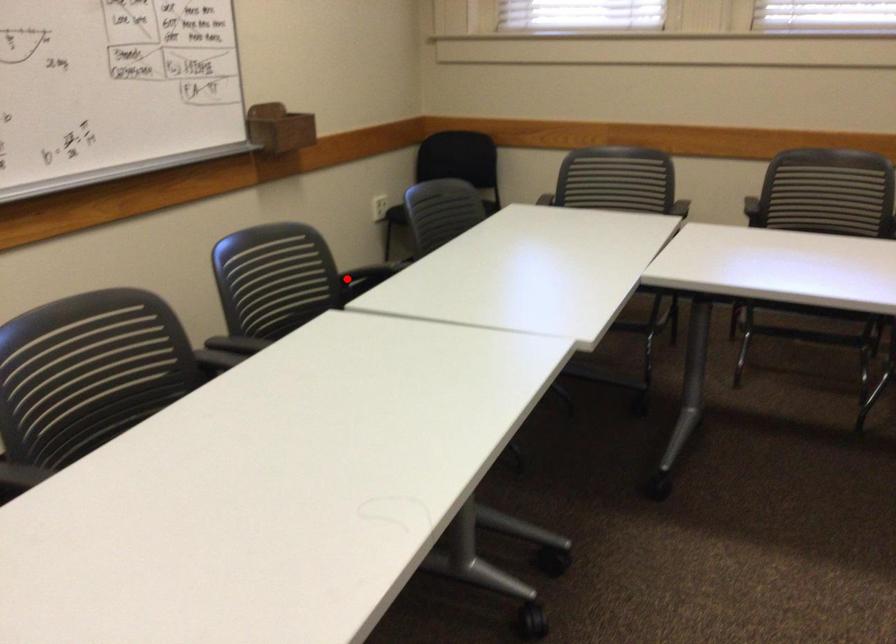
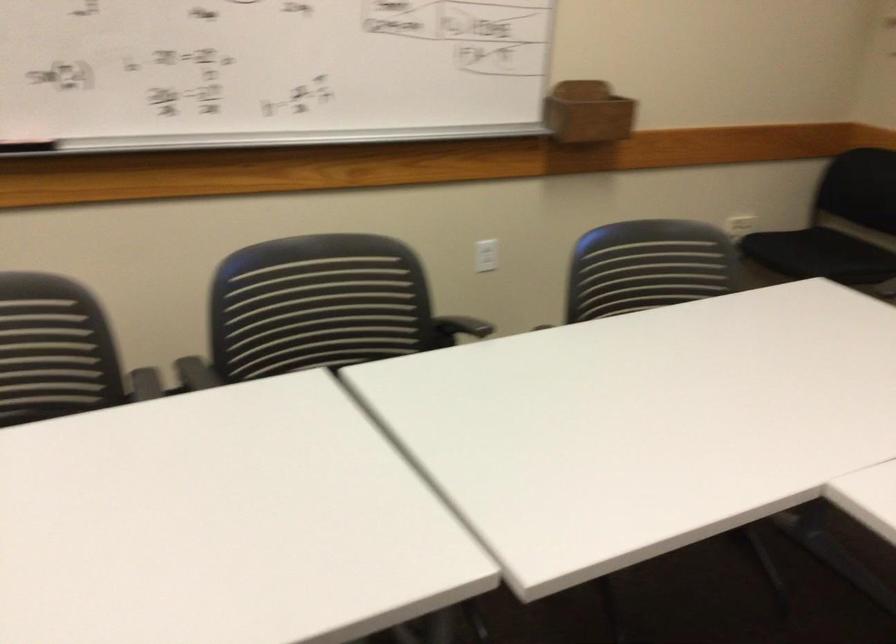
Question: I am providing you with two images of the same scene from different viewpoints. In image1, a red point is highlighted. Considering the same 3D point in image2, which of the following is correct?

Choices:
 (A) It is closer
 (B) It is farther

Answer: (A)